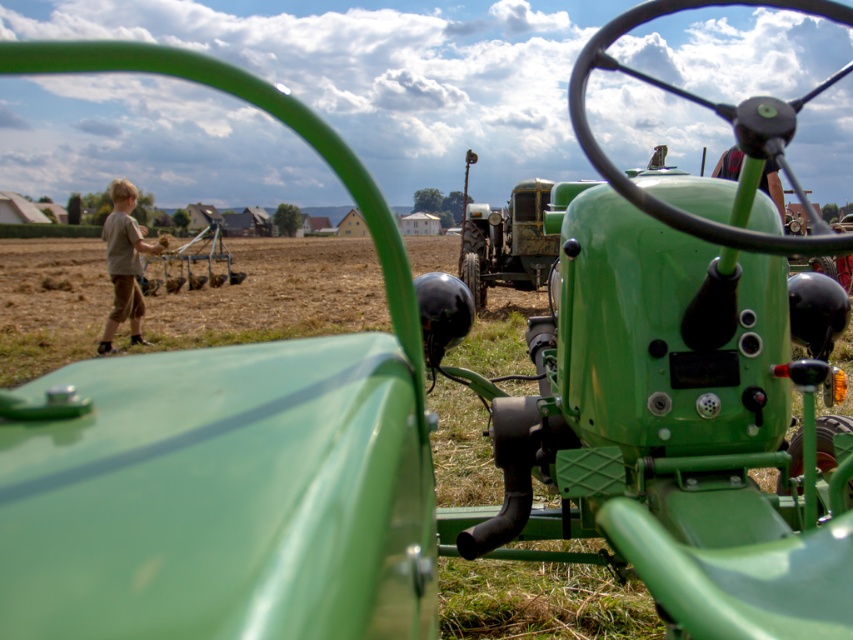
You are a farmer standing at the edge of the field and want to approach both the green matte tractor at center and the brown cotton shirt at left. Which object will you reach first as you move forward?

You will reach the green matte tractor at center first because it is closer to you than the brown cotton shirt at left, which is further away.

You are standing at the origin point of the coordinate system in the image. The green matte tractor at center is located at point (x=506, y=241). If you want to walk towards the green matte tractor at center, in which direction should you move?

The point (x=506, y=241) marks the green matte tractor at center, so you should move towards that coordinate to reach it.

You are standing in the field and see the green matte tractor at center and the brown cotton shirt at left. Which object is positioned more to the right side?

The green matte tractor at center is positioned more to the right side than the brown cotton shirt at left.